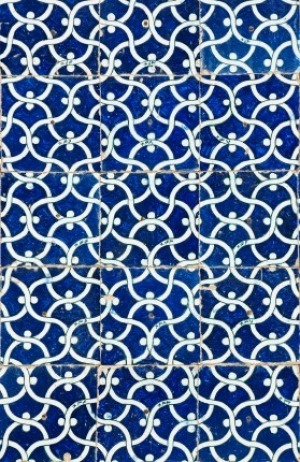
At what (x,y) coordinates should I click in order to perform the action: click on misfit tile that doesn't match the rest. Please return your answer as a coordinate pair (x, y). Looking at the image, I should click on (257, 57).